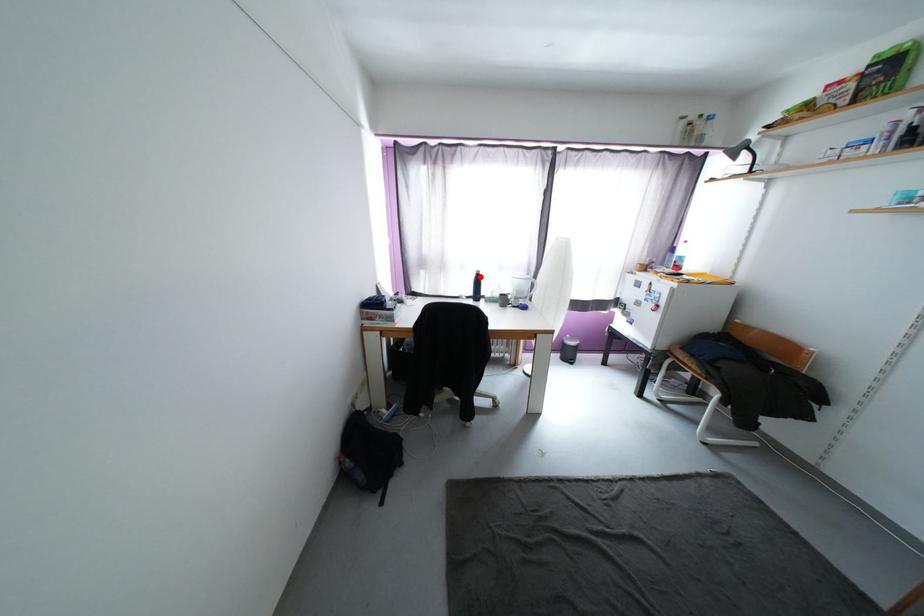
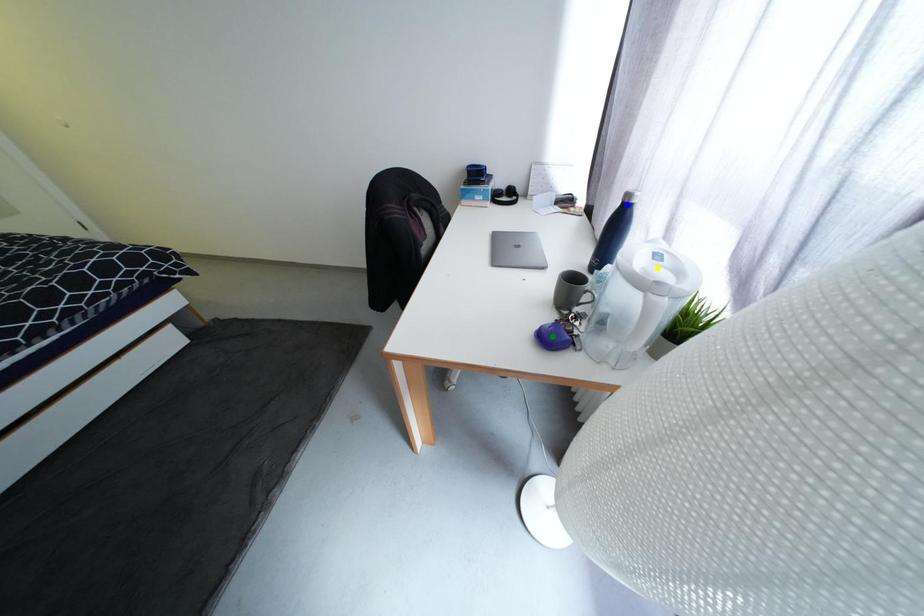
Question: I am providing you with two images of the same scene from different viewpoints. A red point is marked on the first image. You are given multiple points on the second image. Which point in image 2 is actually the same real-world point as the red point in image 1?

Choices:
 (A) yellow point
 (B) blue point
 (C) green point

Answer: (B)